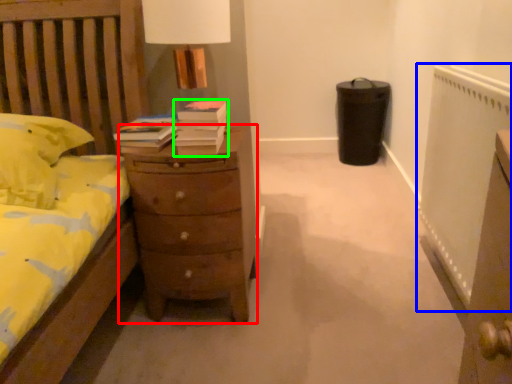
Question: Considering the real-world distances, which object is closest to chest of drawers (highlighted by a red box)? radiator (highlighted by a blue box) or book (highlighted by a green box).

Choices:
 (A) radiator
 (B) book

Answer: (B)